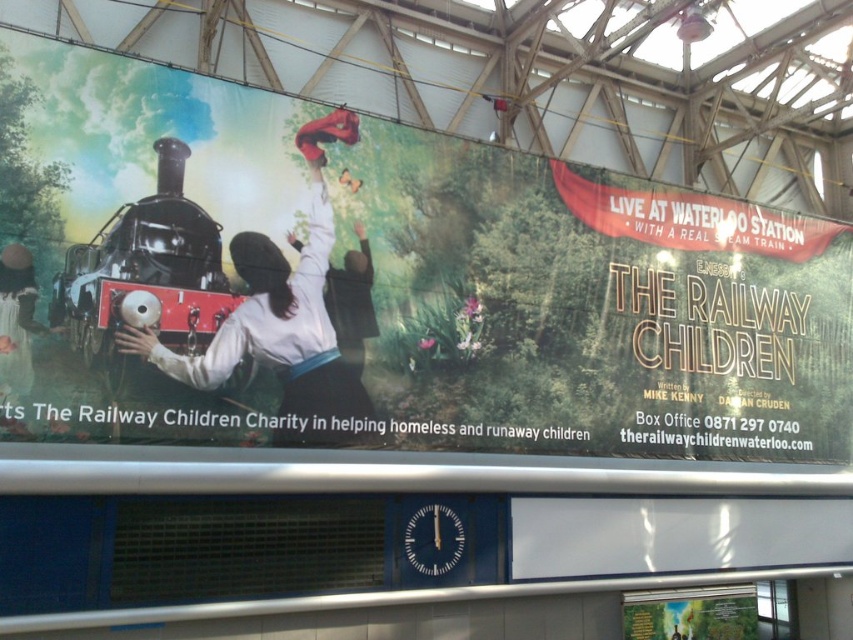
Question: Among these objects, which one is nearest to the camera?

Choices:
 (A) matte black train at upper left
 (B) polished brass steam engine at left

Answer: (A)

Question: Among these objects, which one is farthest from the camera?

Choices:
 (A) polished brass steam engine at left
 (B) matte black train at upper left

Answer: (A)

Question: Does matte black train at upper left have a greater width compared to polished brass steam engine at left?

Choices:
 (A) no
 (B) yes

Answer: (B)

Question: Is the position of matte black train at upper left less distant than that of polished brass steam engine at left?

Choices:
 (A) yes
 (B) no

Answer: (A)

Question: Can you confirm if matte black train at upper left is positioned below polished brass steam engine at left?

Choices:
 (A) yes
 (B) no

Answer: (A)